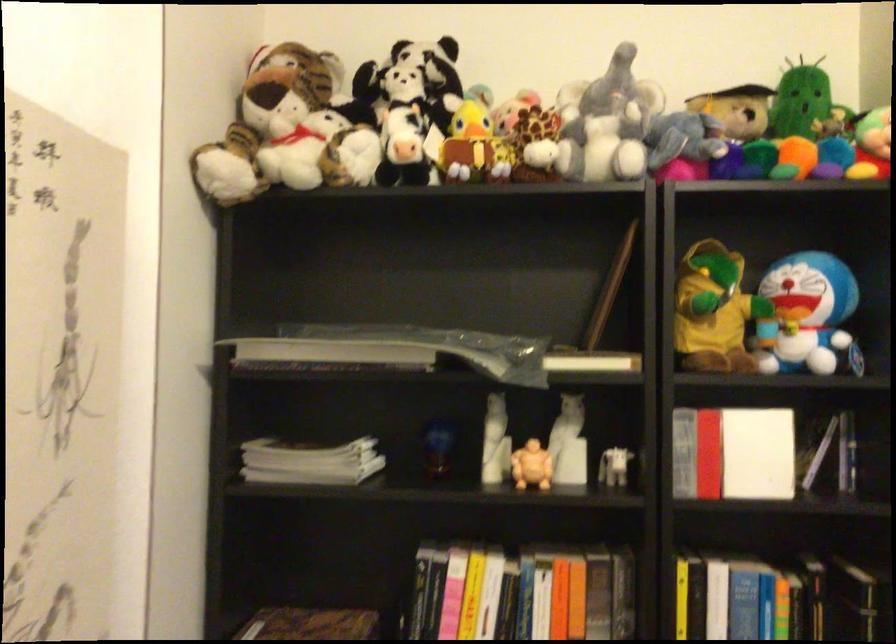
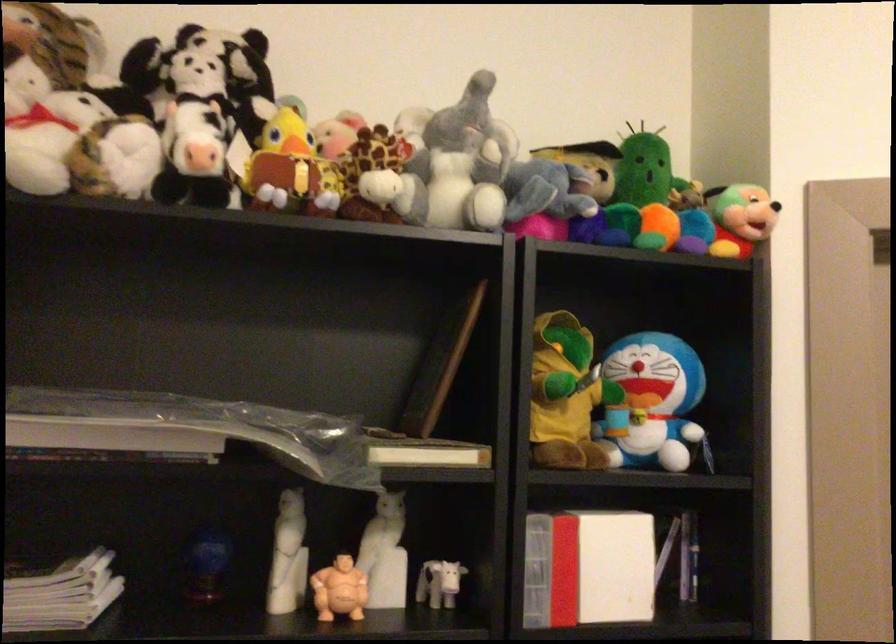
Locate, in the second image, the point that corresponds to (x=803, y=316) in the first image.

(651, 402)